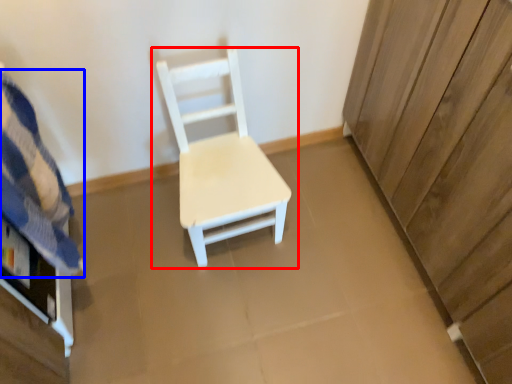
Question: Which object appears closest to the camera in this image, chair (highlighted by a red box) or bedding (highlighted by a blue box)?

Choices:
 (A) chair
 (B) bedding

Answer: (B)